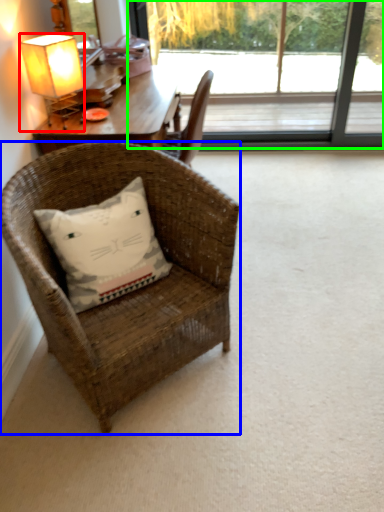
Question: Based on their relative distances, which object is farther from lamp (highlighted by a red box)? Choose from chair (highlighted by a blue box) and window (highlighted by a green box).

Choices:
 (A) chair
 (B) window

Answer: (B)